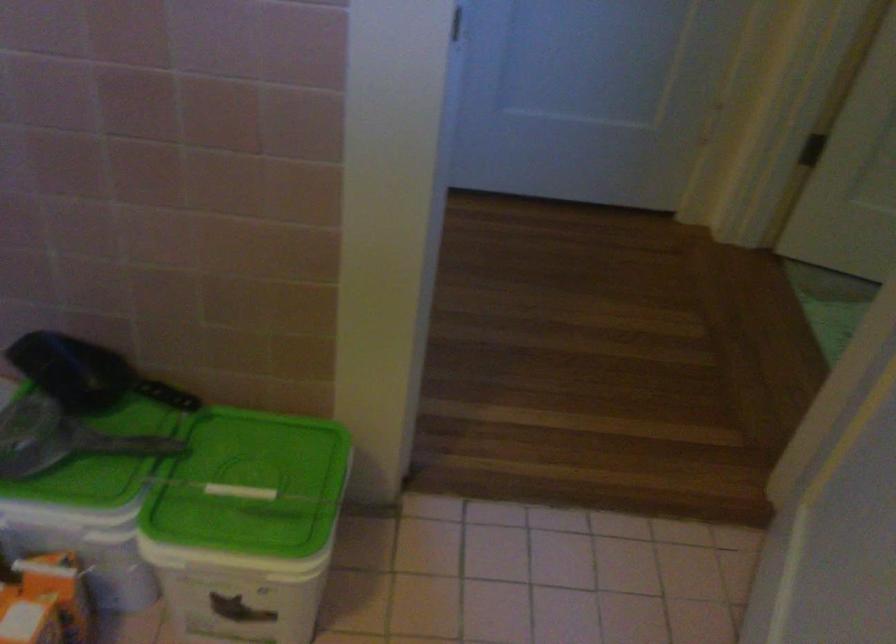
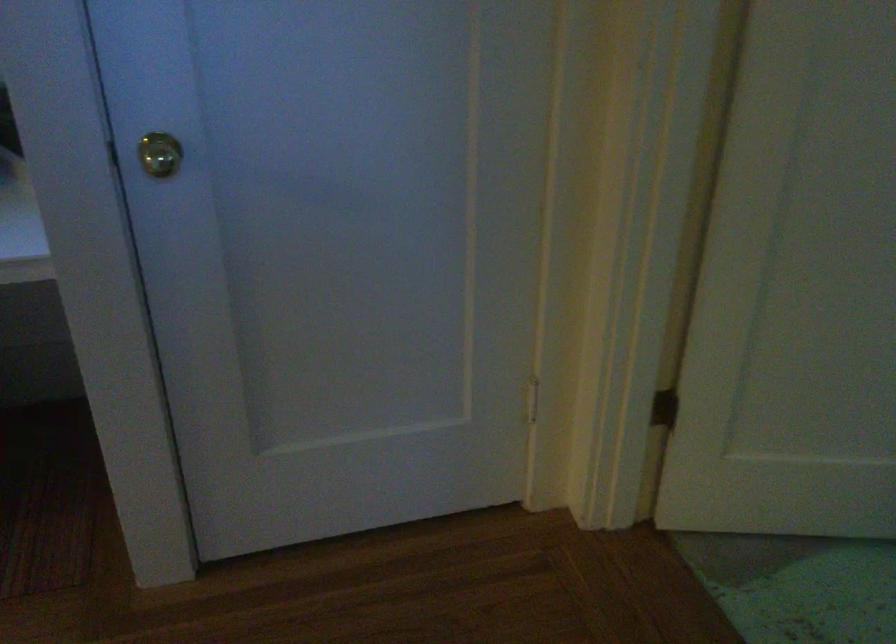
The images are taken continuously from a first-person perspective. In which direction are you moving?

The movement direction of the cameraman is right, forward.